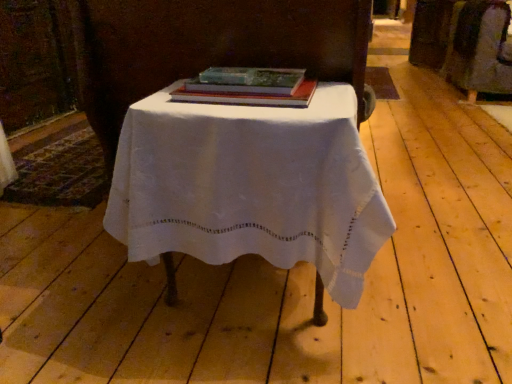
Question: From their relative heights in the image, would you say translucent green glass book at center is taller or shorter than white cloth-covered table at center?

Choices:
 (A) tall
 (B) short

Answer: (B)

Question: Is translucent green glass book at center in front of or behind white cloth-covered table at center in the image?

Choices:
 (A) behind
 (B) front

Answer: (A)

Question: From a real-world perspective, relative to white cloth-covered table at center, is translucent green glass book at center vertically above or below?

Choices:
 (A) below
 (B) above

Answer: (B)

Question: Is white cloth-covered table at center in front of or behind translucent green glass book at center in the image?

Choices:
 (A) front
 (B) behind

Answer: (A)

Question: Considering the positions of white cloth-covered table at center and translucent green glass book at center in the image, is white cloth-covered table at center wider or thinner than translucent green glass book at center?

Choices:
 (A) wide
 (B) thin

Answer: (A)

Question: In terms of size, does white cloth-covered table at center appear bigger or smaller than translucent green glass book at center?

Choices:
 (A) big
 (B) small

Answer: (A)

Question: Would you say white cloth-covered table at center is to the left or to the right of translucent green glass book at center in the picture?

Choices:
 (A) left
 (B) right

Answer: (B)